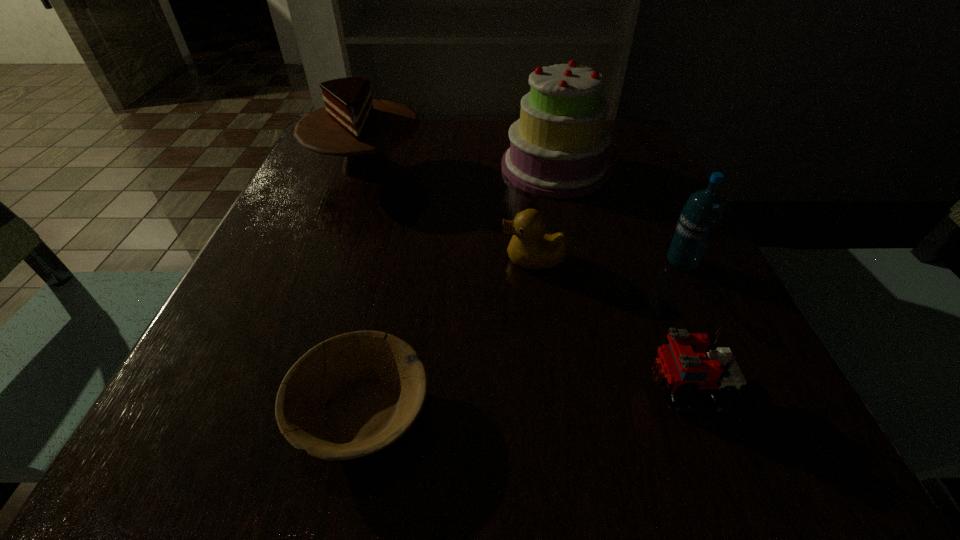
Locate an element on the screen. The image size is (960, 540). bowl at the left edge is located at coordinates (373, 385).

Image resolution: width=960 pixels, height=540 pixels. Identify the location of cake at the right edge. (558, 148).

This screenshot has height=540, width=960. What are the coordinates of `water bottle that is at the right edge` in the screenshot? It's located at (699, 219).

This screenshot has width=960, height=540. I want to click on Lego situated at the right edge, so click(x=690, y=362).

In order to click on object that is positioned at the far left corner in this screenshot , I will do `click(351, 124)`.

You are a GUI agent. You are given a task and a screenshot of the screen. Output one action in this format:
    pyautogui.click(x=<x>, y=<y>)
    Task: Click on the object that is at the near left corner
    
    Given the screenshot: What is the action you would take?
    pyautogui.click(x=373, y=385)

Identify the location of object that is at the far right corner. (558, 148).

At what (x,y) coordinates should I click in order to perform the action: click on object positioned at the near right corner. Please return your answer as a coordinate pair (x, y). Looking at the image, I should click on (690, 362).

Where is `vacant space at the far edge`? vacant space at the far edge is located at coordinates (466, 146).

At what (x,y) coordinates should I click in order to perform the action: click on vacant space at the right edge of the desktop. Please return your answer as a coordinate pair (x, y). The height and width of the screenshot is (540, 960). Looking at the image, I should click on tap(653, 198).